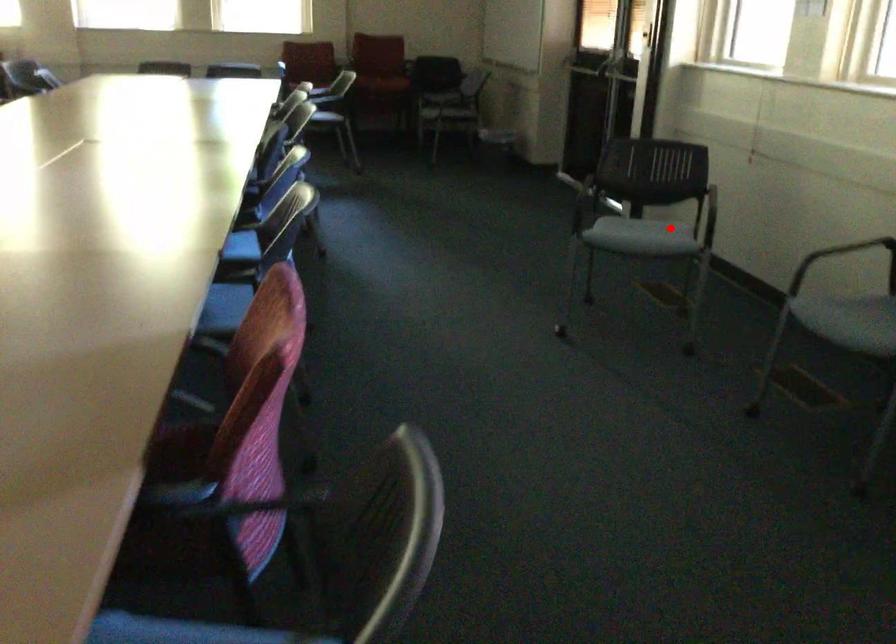
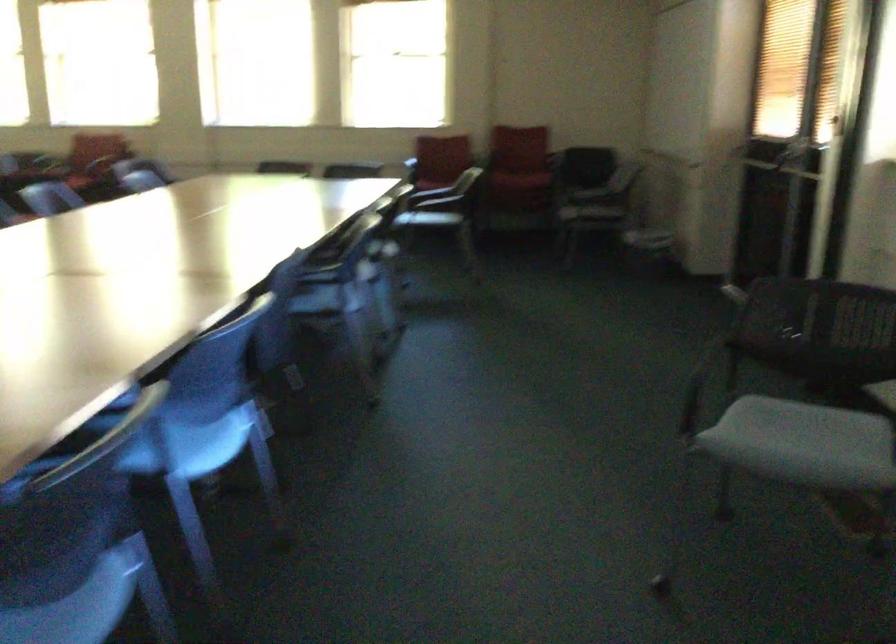
Locate, in the second image, the point that corresponds to the highlighted location in the first image.

(838, 444)